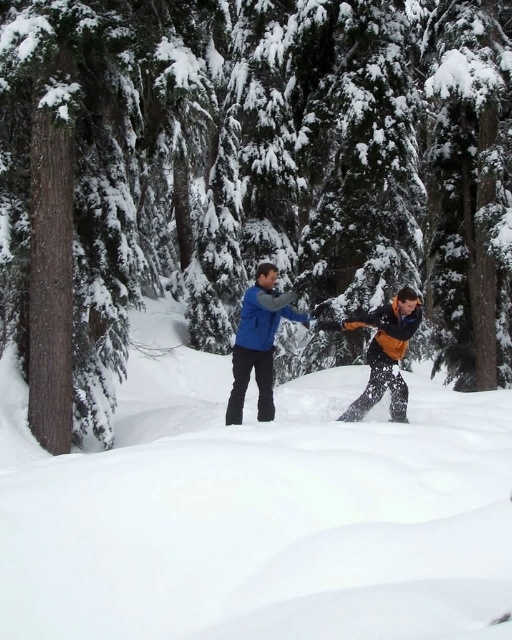
Measure the distance from brown textured trunk at center to blue matte jacket at center.

19.17 feet

Does brown textured trunk at center have a lesser height compared to blue matte jacket at center?

No.

Is point (98, 188) farther from viewer compared to point (244, 323)?

Yes, it is.

Where is `brown textured trunk at center`? brown textured trunk at center is located at coordinates (245, 176).

Is brown textured trunk at center bigger than white fluffy snow at center?

Correct, brown textured trunk at center is larger in size than white fluffy snow at center.

Who is taller, brown textured trunk at center or white fluffy snow at center?

brown textured trunk at center is taller.

Where is `brown textured trunk at center`? brown textured trunk at center is located at coordinates coord(245,176).

Is white fluffy snow at center wider than blue matte jacket at center?

Yes, white fluffy snow at center is wider than blue matte jacket at center.

Between point (60, 614) and point (249, 308), which one is positioned in front?

Point (60, 614) is more forward.

Which is behind, point (273, 438) or point (236, 385)?

Point (236, 385)

At what (x,y) coordinates should I click in order to perform the action: click on white fluffy snow at center. Please return your answer as a coordinate pair (x, y). Looking at the image, I should click on (259, 513).